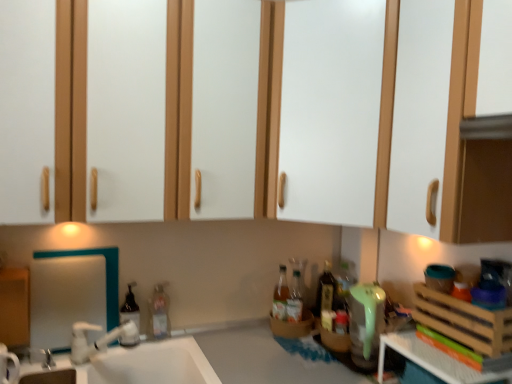
Question: From a real-world perspective, is wooden crate at right, which appears as the 3th basket when ordered from the bottom, below translucent glass bottle at center, which is the fourth bottle in left-to-right order?

Choices:
 (A) no
 (B) yes

Answer: (A)

Question: Is wooden crate at right, the first basket from the right, positioned beyond the bounds of translucent glass bottle at center, the first bottle positioned from the right?

Choices:
 (A) no
 (B) yes

Answer: (B)

Question: From a real-world perspective, is wooden crate at right, the 3th basket positioned from the left, over translucent glass bottle at center, the first bottle positioned from the right?

Choices:
 (A) no
 (B) yes

Answer: (B)

Question: Does wooden crate at right, the first basket from the right, have a larger size compared to translucent glass bottle at center, which is the fourth bottle in left-to-right order?

Choices:
 (A) no
 (B) yes

Answer: (B)

Question: Are wooden crate at right, which is the 3th basket in back-to-front order, and translucent glass bottle at center, which is the fourth bottle in left-to-right order, located far from each other?

Choices:
 (A) no
 (B) yes

Answer: (A)

Question: Can you confirm if wooden crate at right, the 3th basket positioned from the left, is wider than translucent glass bottle at center, the first bottle positioned from the right?

Choices:
 (A) yes
 (B) no

Answer: (A)

Question: Can you see translucent plastic soap dispenser at sink, placed as the 1th bottle when sorted from left to right, touching translucent glass bottle at center, the first bottle positioned from the right?

Choices:
 (A) no
 (B) yes

Answer: (A)

Question: Considering the relative sizes of translucent plastic soap dispenser at sink, placed as the 1th bottle when sorted from left to right, and translucent glass bottle at center, which is the fourth bottle in left-to-right order, in the image provided, is translucent plastic soap dispenser at sink, placed as the 1th bottle when sorted from left to right, wider than translucent glass bottle at center, which is the fourth bottle in left-to-right order,?

Choices:
 (A) yes
 (B) no

Answer: (B)

Question: Is translucent plastic soap dispenser at sink, placed as the 1th bottle when sorted from left to right, turned away from translucent glass bottle at center, the first bottle positioned from the right?

Choices:
 (A) no
 (B) yes

Answer: (A)

Question: From the image's perspective, is translucent plastic soap dispenser at sink, the 4th bottle in the right-to-left sequence, located above translucent glass bottle at center, the first bottle positioned from the right?

Choices:
 (A) yes
 (B) no

Answer: (B)

Question: Would you say translucent plastic soap dispenser at sink, placed as the 1th bottle when sorted from left to right, is a long distance from translucent glass bottle at center, which is the fourth bottle in left-to-right order?

Choices:
 (A) no
 (B) yes

Answer: (A)

Question: From the image's perspective, is translucent plastic soap dispenser at sink, placed as the 1th bottle when sorted from left to right, below translucent glass bottle at center, the first bottle positioned from the right?

Choices:
 (A) yes
 (B) no

Answer: (A)

Question: From a real-world perspective, is white glossy sink at lower left positioned under translucent plastic bottle at sink, which ranks as the 3th bottle in right-to-left order, based on gravity?

Choices:
 (A) no
 (B) yes

Answer: (B)